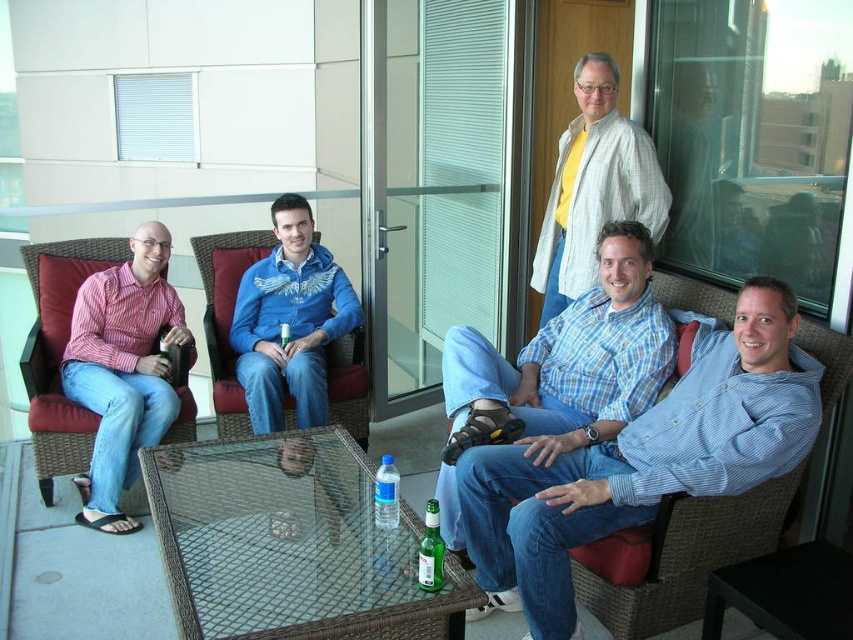
You are a photographer trying to capture a closeup of the blue striped shirt at center and the blue fleece jacket at center. Which one should you zoom in on to ensure it fills the frame more?

The blue striped shirt at center is larger in size than the blue fleece jacket at center, so you should zoom in on the blue striped shirt at center to ensure it fills the frame more.

You are a photographer trying to capture a candid shot of the blue plaid shirt at center and the green glass bottle at center. To ensure both subjects are in focus, you need to know their relative positions. Which object is located to the right of the other?

The blue plaid shirt at center is positioned on the right side of the green glass bottle at center, so the blue plaid shirt at center is to the right of the green glass bottle at center.

You are a delivery person who needs to place a small package between the blue plaid shirt at center and the green glass bottle at center. Can you fit the package if it measures 12 inches in length?

The distance between the blue plaid shirt at center and the green glass bottle at center is 33.18 inches. Since the package is only 12 inches long, there is enough space to place it between them.